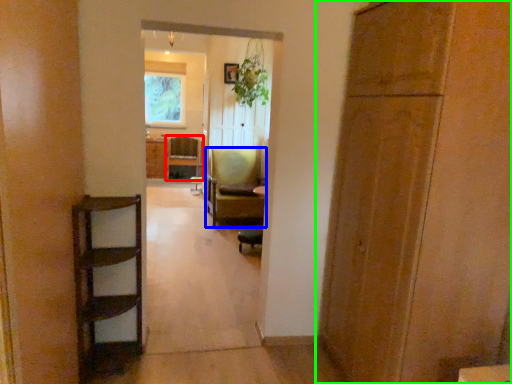
Question: Considering the real-world distances, which object is closest to chair (highlighted by a red box)? chair (highlighted by a blue box) or door (highlighted by a green box).

Choices:
 (A) chair
 (B) door

Answer: (A)